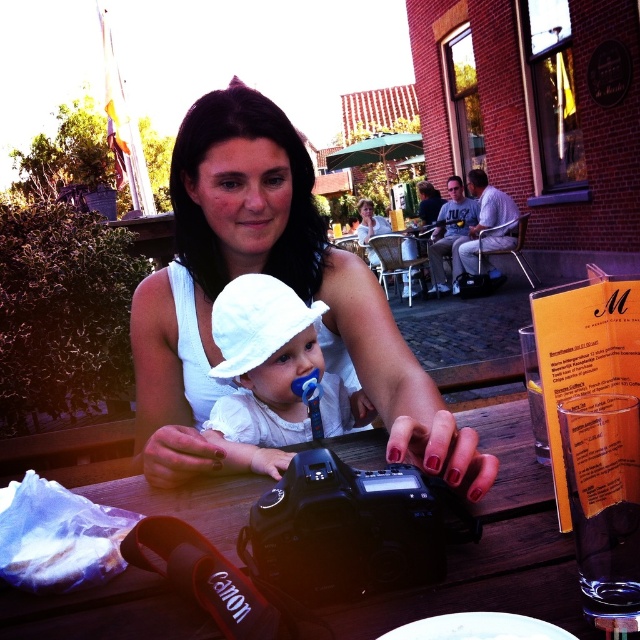
You are a photographer at the outdoor cafe and need to place a small accessory next to the white matte shirt at center and the white paper bag at lower left. Which object should you place it closer to if you want it to be more noticeable?

The white matte shirt at center is bigger than the white paper bag at lower left, so placing the accessory closer to the white matte shirt at center would make it more noticeable due to its larger size.

From the picture: You are a photographer at the outdoor cafe scene. You need to place a 10cm wide accessory between the white matte shirt at center and the white paper bag at lower left. Can you fit it there?

The white matte shirt at center is wider than the white paper bag at lower left, so the 10cm wide accessory can be placed between them as there is enough space.